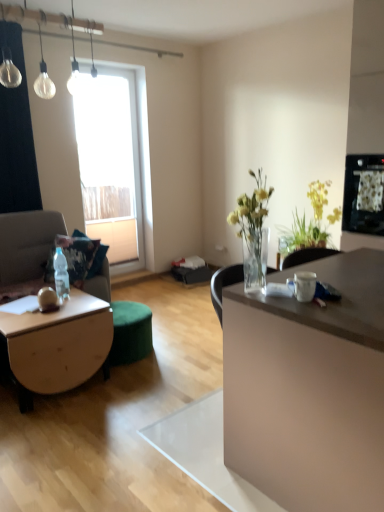
Locate an element on the screen. The width and height of the screenshot is (384, 512). vacant area that is in front of white glossy mug at center is located at coordinates (308, 310).